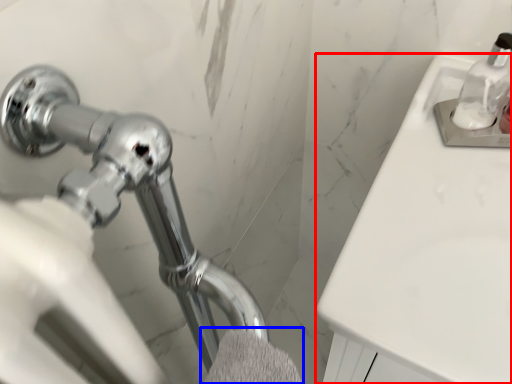
Question: Which point is closer to the camera, counter top (highlighted by a red box) or bath towel (highlighted by a blue box)?

Choices:
 (A) counter top
 (B) bath towel

Answer: (B)